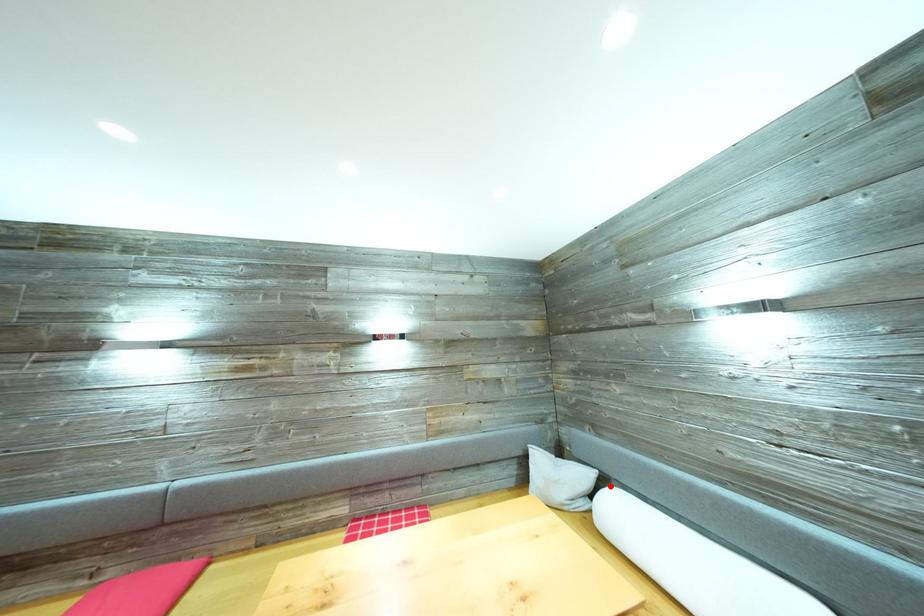
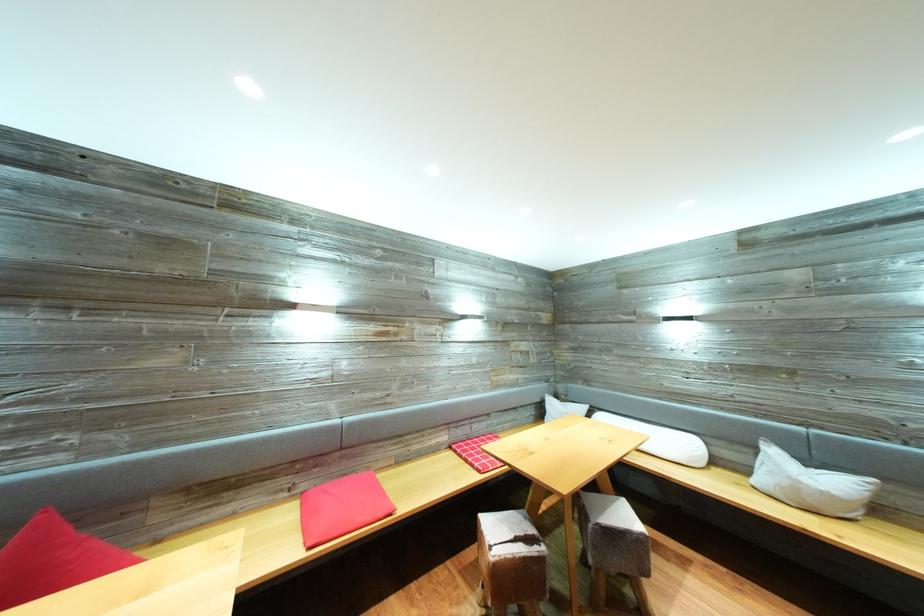
Question: I am providing you with two images of the same scene from different viewpoints. A red point is marked on the first image. Is the red point's position out of view in image 2?

Choices:
 (A) Yes
 (B) No

Answer: (A)